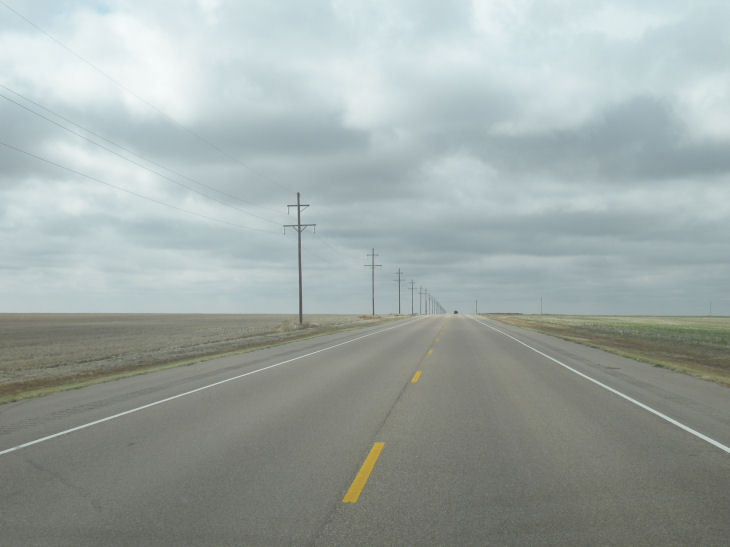
You are a GUI agent. You are given a task and a screenshot of the screen. Output one action in this format:
    pyautogui.click(x=<x>, y=<y>)
    Task: Click on the cord
    This screenshot has width=730, height=547.
    Given the screenshot: What is the action you would take?
    pyautogui.click(x=128, y=90)